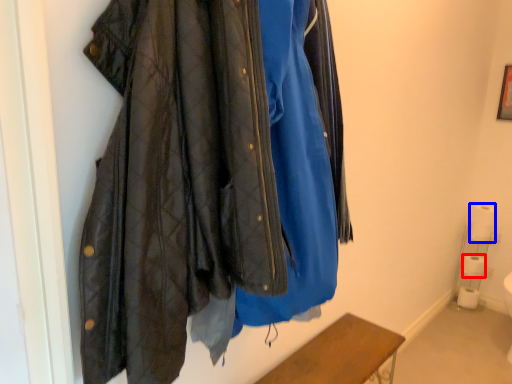
Question: Which object is closer to the camera taking this photo, toilet paper (highlighted by a red box) or toilet paper (highlighted by a blue box)?

Choices:
 (A) toilet paper
 (B) toilet paper

Answer: (B)